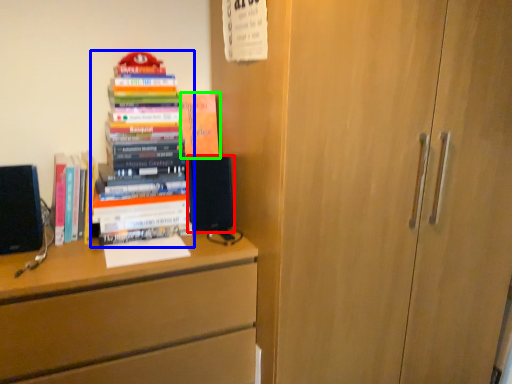
Question: Considering the real-world distances, which object is farthest from speaker (highlighted by a red box)? book (highlighted by a blue box) or book (highlighted by a green box)?

Choices:
 (A) book
 (B) book

Answer: (B)